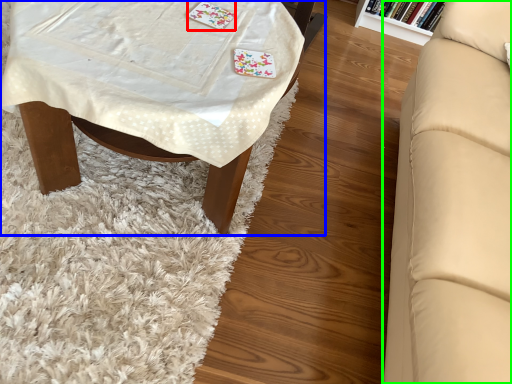
Question: Estimate the real-world distances between objects in this image. Which object is farther from card game (highlighted by a red box), table (highlighted by a blue box) or studio couch (highlighted by a green box)?

Choices:
 (A) table
 (B) studio couch

Answer: (B)